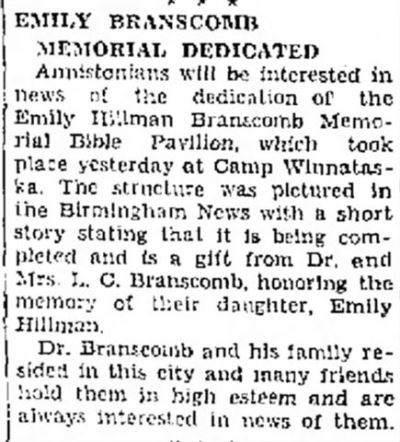
Identify the location of newspaper. The image size is (400, 442). (239, 225).